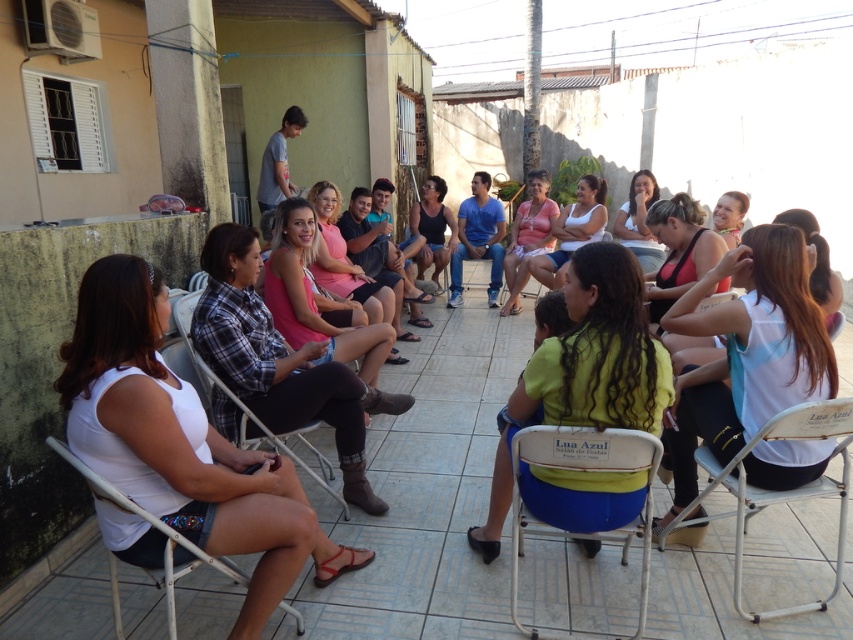
Consider the image. Is yellow fabric shirt at center wider than metallic silver chair at center?

Incorrect, yellow fabric shirt at center's width does not surpass metallic silver chair at center's.

Does point (622, 317) lie in front of point (241, 428)?

Yes, point (622, 317) is in front of point (241, 428).

This screenshot has width=853, height=640. In order to click on yellow fabric shirt at center in this screenshot , I will do `click(596, 353)`.

Who is higher up, white fabric shirt at lower left or white metal chair at lower right?

Positioned higher is white fabric shirt at lower left.

Does point (80, 413) lie in front of point (703, 496)?

Yes, it is.

Where is `white fabric shirt at lower left`? white fabric shirt at lower left is located at coordinates (181, 444).

Measure the distance from white fabric shirt at lower left to white plastic chair at lower left.

white fabric shirt at lower left and white plastic chair at lower left are 17.86 centimeters apart.

Is white fabric shirt at lower left behind white plastic chair at lower left?

Yes, it is behind white plastic chair at lower left.

Does point (228, 476) come behind point (175, 636)?

Yes, it is behind point (175, 636).

Find the location of a particular element. This screenshot has width=853, height=640. white fabric shirt at lower left is located at coordinates (x=181, y=444).